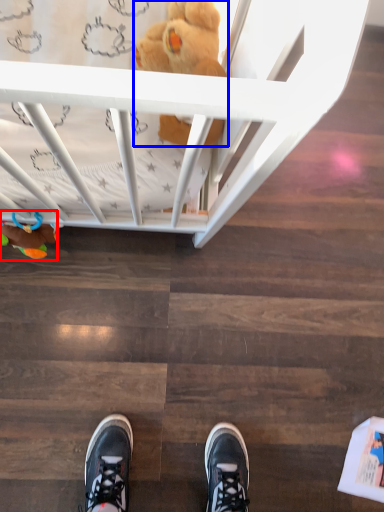
Question: Which of the following is the farthest to the observer, toy (highlighted by a red box) or toy (highlighted by a blue box)?

Choices:
 (A) toy
 (B) toy

Answer: (A)